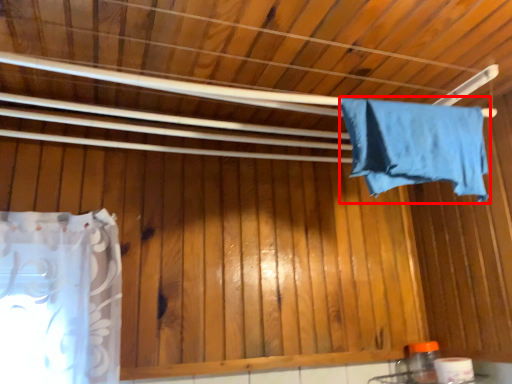
Question: From the image's perspective, where is towel (annotated by the red box) located in relation to toilet paper in the image?

Choices:
 (A) below
 (B) above

Answer: (B)